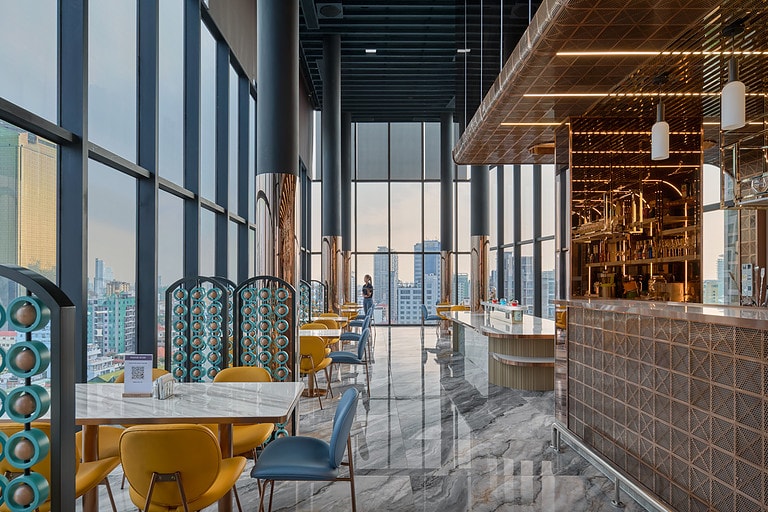
Locate an element on the screen. room dividers is located at coordinates (61, 359), (170, 318), (295, 324), (310, 308), (323, 298), (329, 286).